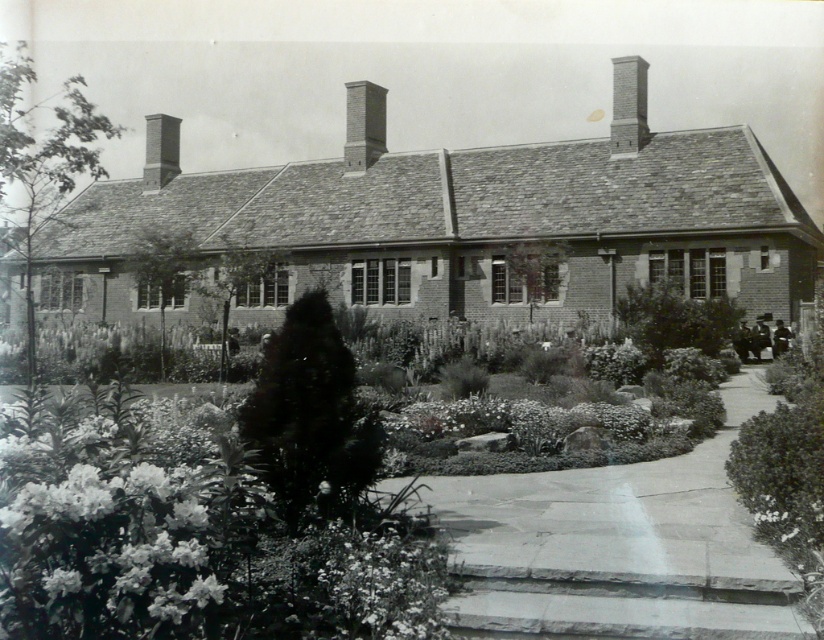
Question: Which object is positioned farthest from the white fluffy flower at lower center?

Choices:
 (A) smooth brick chimney at upper center
 (B) smooth brick chimney at center

Answer: (A)

Question: Which object appears farthest from the camera in this image?

Choices:
 (A) smooth brick chimney at center
 (B) white fluffy flower at lower center
 (C) smooth brick chimney at upper right

Answer: (A)

Question: Is white fluffy flower at lower center in front of smooth brick chimney at upper right?

Choices:
 (A) no
 (B) yes

Answer: (B)

Question: Can you confirm if white fluffy flower at lower center is positioned below smooth brick chimney at upper center?

Choices:
 (A) no
 (B) yes

Answer: (B)

Question: Which of these objects is positioned farthest from the fluffy green shrubbery at center?

Choices:
 (A) smooth brick chimney at center
 (B) white fluffy flower at lower center
 (C) smooth brick chimney at upper center
 (D) smooth brick chimney at upper right

Answer: (C)

Question: Can you confirm if smooth brick chimney at center is positioned to the right of smooth brick chimney at upper center?

Choices:
 (A) yes
 (B) no

Answer: (A)